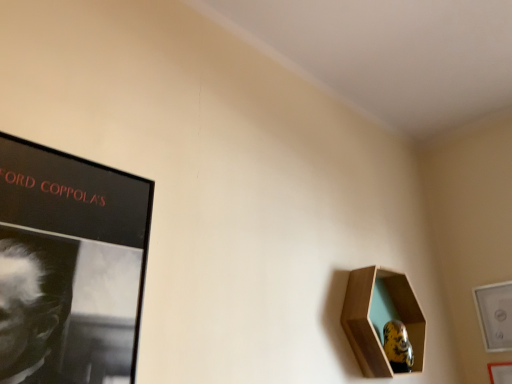
Question: Is wooden picture frame at lower right, arranged as the first picture frame when viewed from the right, not inside wooden hexagonal frame at lower right, marked as the third picture frame in a right-to-left arrangement?

Choices:
 (A) no
 (B) yes

Answer: (B)

Question: Is wooden picture frame at lower right, arranged as the first picture frame when viewed from the right, taller than wooden hexagonal frame at lower right, which is the 1th picture frame in left-to-right order?

Choices:
 (A) yes
 (B) no

Answer: (B)

Question: From the image's perspective, is wooden picture frame at lower right, arranged as the first picture frame when viewed from the right, over wooden hexagonal frame at lower right, which is the 1th picture frame in left-to-right order?

Choices:
 (A) yes
 (B) no

Answer: (B)

Question: Are wooden picture frame at lower right, marked as the third picture frame in a left-to-right arrangement, and wooden hexagonal frame at lower right, marked as the third picture frame in a right-to-left arrangement, beside each other?

Choices:
 (A) yes
 (B) no

Answer: (B)

Question: Is wooden picture frame at lower right, arranged as the first picture frame when viewed from the right, in front of wooden hexagonal frame at lower right, which is the 1th picture frame in left-to-right order?

Choices:
 (A) yes
 (B) no

Answer: (B)

Question: Is wooden picture frame at lower right, arranged as the first picture frame when viewed from the right, thinner than wooden hexagonal frame at lower right, which is the 1th picture frame in left-to-right order?

Choices:
 (A) no
 (B) yes

Answer: (B)

Question: Is wooden picture frame at lower right, marked as the third picture frame in a left-to-right arrangement, positioned before white glossy picture frame at lower right, the second picture frame when ordered from right to left?

Choices:
 (A) yes
 (B) no

Answer: (A)

Question: Can you confirm if wooden picture frame at lower right, marked as the third picture frame in a left-to-right arrangement, is positioned to the left of white glossy picture frame at lower right, the second picture frame when ordered from right to left?

Choices:
 (A) no
 (B) yes

Answer: (A)

Question: Is wooden picture frame at lower right, arranged as the first picture frame when viewed from the right, located outside white glossy picture frame at lower right, placed as the 2th picture frame when sorted from left to right?

Choices:
 (A) no
 (B) yes

Answer: (B)

Question: Are wooden picture frame at lower right, marked as the third picture frame in a left-to-right arrangement, and white glossy picture frame at lower right, placed as the 2th picture frame when sorted from left to right, far apart?

Choices:
 (A) no
 (B) yes

Answer: (A)

Question: From a real-world perspective, is wooden picture frame at lower right, marked as the third picture frame in a left-to-right arrangement, positioned under white glossy picture frame at lower right, placed as the 2th picture frame when sorted from left to right, based on gravity?

Choices:
 (A) no
 (B) yes

Answer: (B)

Question: Is wooden picture frame at lower right, arranged as the first picture frame when viewed from the right, aimed at white glossy picture frame at lower right, placed as the 2th picture frame when sorted from left to right?

Choices:
 (A) yes
 (B) no

Answer: (B)

Question: Is wooden hexagonal frame at lower right, which is the 1th picture frame in left-to-right order, not close to white glossy picture frame at lower right, placed as the 2th picture frame when sorted from left to right?

Choices:
 (A) no
 (B) yes

Answer: (A)